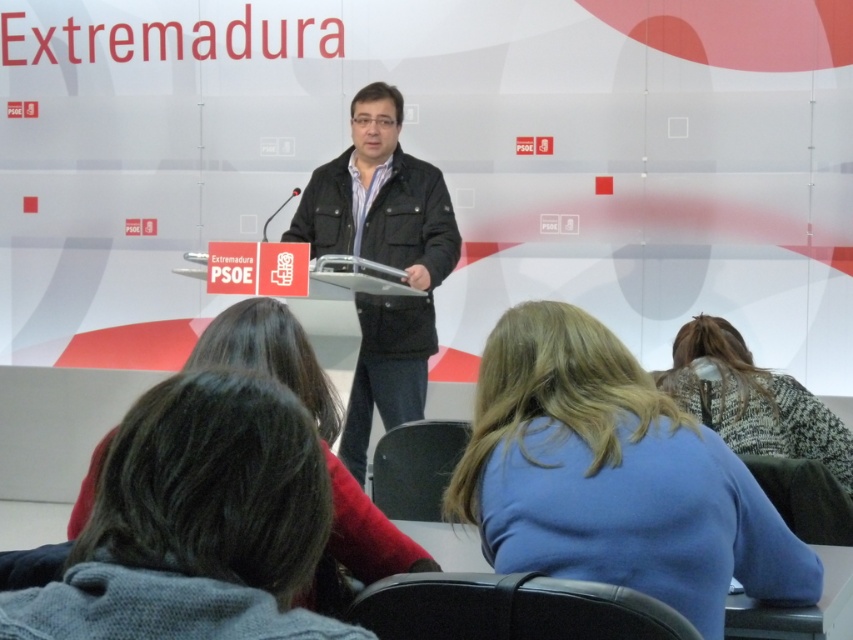
Question: Among these points, which one is farthest from the camera?

Choices:
 (A) (369, 339)
 (B) (283, 330)
 (C) (688, 362)
 (D) (480, 474)

Answer: (A)

Question: Which object is the farthest from the blue fabric shirt at center?

Choices:
 (A) patterned sweater at center
 (B) dark brown leather jacket at center
 (C) dark brown hair at center

Answer: (B)

Question: Which of these objects is positioned farthest from the dark brown hair at center?

Choices:
 (A) dark brown leather jacket at center
 (B) patterned sweater at center

Answer: (A)

Question: Is dark brown leather jacket at center behind dark brown hair at center?

Choices:
 (A) yes
 (B) no

Answer: (A)

Question: Does dark brown hair at center appear over patterned sweater at center?

Choices:
 (A) yes
 (B) no

Answer: (A)

Question: From the image, what is the correct spatial relationship of dark brown leather jacket at center in relation to patterned sweater at center?

Choices:
 (A) above
 (B) below

Answer: (A)